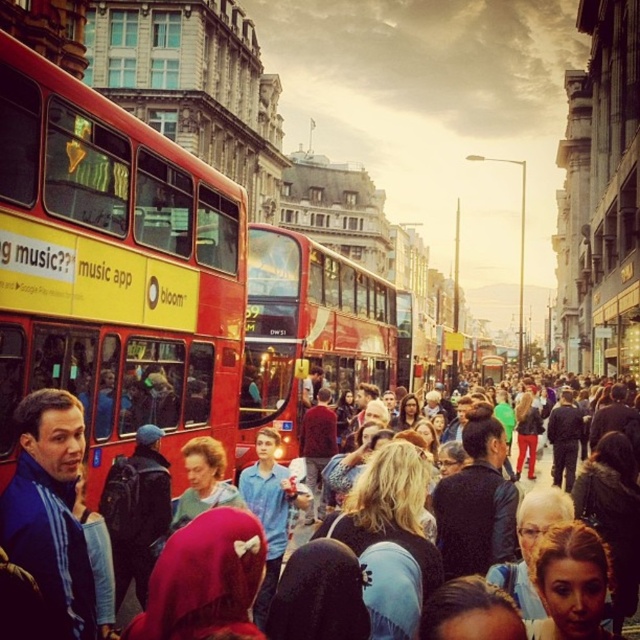
Does matte yellow double-decker bus at left have a lesser width compared to matte red bus at center?

Correct, matte yellow double-decker bus at left's width is less than matte red bus at center's.

Does matte yellow double-decker bus at left have a smaller size compared to matte red bus at center?

Correct, matte yellow double-decker bus at left occupies less space than matte red bus at center.

Where is `matte yellow double-decker bus at left`? The width and height of the screenshot is (640, 640). matte yellow double-decker bus at left is located at coordinates (113, 269).

Is point (115, 397) farther from camera compared to point (355, 284)?

No.

Who is more forward, [234,308] or [275,262]?

Point [234,308]

Locate an element on the screen. matte yellow double-decker bus at left is located at coordinates (113, 269).

Does point (381, 376) come behind point (296, 540)?

Yes, it is.

The height and width of the screenshot is (640, 640). What do you see at coordinates (307, 332) in the screenshot?
I see `red double-decker bus at center` at bounding box center [307, 332].

The height and width of the screenshot is (640, 640). In order to click on red double-decker bus at center in this screenshot , I will do `click(307, 332)`.